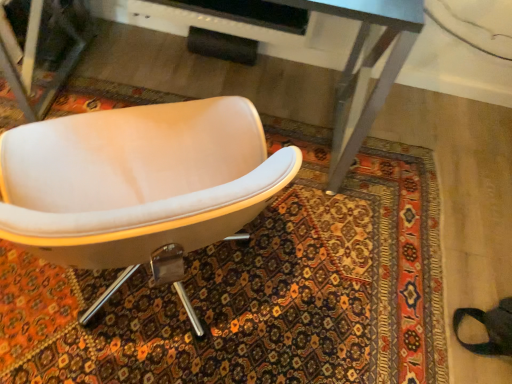
You are a GUI agent. You are given a task and a screenshot of the screen. Output one action in this format:
    pyautogui.click(x=<x>, y=<y>)
    Task: Click on the free spot to the right of white leather chair at center
    The height and width of the screenshot is (384, 512).
    Given the screenshot: What is the action you would take?
    pyautogui.click(x=327, y=278)